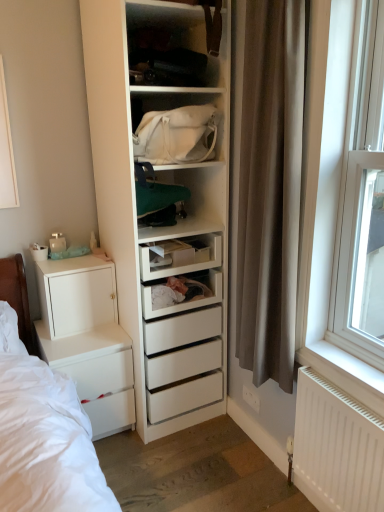
What do you see at coordinates (173, 46) in the screenshot? The width and height of the screenshot is (384, 512). I see `matte white shelf at upper center, the 2th shelf ordered from the bottom` at bounding box center [173, 46].

This screenshot has height=512, width=384. What do you see at coordinates (87, 338) in the screenshot? I see `white matte chest of drawers at left` at bounding box center [87, 338].

Describe the element at coordinates (324, 177) in the screenshot. This screenshot has height=512, width=384. I see `white plastic window at right` at that location.

Where is `white canvas bag at center, the first shelf in the bottom-to-top sequence`? white canvas bag at center, the first shelf in the bottom-to-top sequence is located at coordinates (177, 135).

The height and width of the screenshot is (512, 384). In order to click on brown fabric curtain at right in this screenshot , I will do `click(270, 188)`.

The image size is (384, 512). I want to click on matte white shelf at upper center, arranged as the 1th shelf when viewed from the top, so click(x=173, y=46).

From a real-world perspective, is white plastic window at right located higher than white canvas bag at center, the first shelf in the bottom-to-top sequence?

No.

Which object is thinner, white plastic window at right or white canvas bag at center, the first shelf in the bottom-to-top sequence?

white plastic window at right is thinner.

From the image's perspective, between white plastic window at right and white canvas bag at center, the first shelf in the bottom-to-top sequence, who is located below?

white plastic window at right appears lower in the image.

From their relative heights in the image, would you say white plastic window at right is taller or shorter than white matte cabinet at lower left?

In the image, white plastic window at right appears to be taller than white matte cabinet at lower left.

Who is more distant, white plastic window at right or white matte cabinet at lower left?

white matte cabinet at lower left is further away from the camera.

Is white plastic window at right inside or outside of white matte cabinet at lower left?

white plastic window at right exists outside the volume of white matte cabinet at lower left.

Is white plastic window at right looking in the opposite direction of white matte cabinet at lower left?

No, white plastic window at right is not facing away from white matte cabinet at lower left.

Considering the relative positions of white matte cabinet at lower left and matte white shelf at upper center, the 2th shelf ordered from the bottom, in the image provided, is white matte cabinet at lower left to the right of matte white shelf at upper center, the 2th shelf ordered from the bottom, from the viewer's perspective?

In fact, white matte cabinet at lower left is to the left of matte white shelf at upper center, the 2th shelf ordered from the bottom.

From the image's perspective, relative to matte white shelf at upper center, the 2th shelf ordered from the bottom, is white matte cabinet at lower left above or below?

From the image's perspective, white matte cabinet at lower left appears below matte white shelf at upper center, the 2th shelf ordered from the bottom.

Is white matte cabinet at lower left smaller than matte white shelf at upper center, arranged as the 1th shelf when viewed from the top?

Actually, white matte cabinet at lower left might be larger than matte white shelf at upper center, arranged as the 1th shelf when viewed from the top.

Between white plastic window at right and white matte radiator at lower right, which one appears on the left side from the viewer's perspective?

From the viewer's perspective, white matte radiator at lower right appears more on the left side.

Measure the distance between white plastic window at right and white matte radiator at lower right.

white plastic window at right is 15.53 inches away from white matte radiator at lower right.

How different are the orientations of white plastic window at right and white matte radiator at lower right in degrees?

The facing directions of white plastic window at right and white matte radiator at lower right are 0.0696 degrees apart.

Which of these two, white plastic window at right or white matte radiator at lower right, is bigger?

white plastic window at right.

Does white matte radiator at lower right have a greater height compared to brown fabric curtain at right?

No, white matte radiator at lower right is not taller than brown fabric curtain at right.

In order to click on curtain on the left side of white matte radiator at lower right in this screenshot , I will do `click(270, 188)`.

Can you tell me how much white matte radiator at lower right and brown fabric curtain at right differ in facing direction?

0.0705 degrees separate the facing orientations of white matte radiator at lower right and brown fabric curtain at right.

Considering the relative positions of white matte radiator at lower right and brown fabric curtain at right in the image provided, is white matte radiator at lower right in front of brown fabric curtain at right?

No, it is behind brown fabric curtain at right.

Considering the relative sizes of white matte cabinet at lower left and white canvas bag at center, marked as the 2th shelf in a top-to-bottom arrangement, in the image provided, is white matte cabinet at lower left shorter than white canvas bag at center, marked as the 2th shelf in a top-to-bottom arrangement,?

No.

Does point (75, 321) come closer to viewer compared to point (133, 105)?

No, (75, 321) is behind (133, 105).

Does white matte cabinet at lower left appear on the right side of white canvas bag at center, marked as the 2th shelf in a top-to-bottom arrangement?

No.

Is white matte cabinet at lower left aimed at white canvas bag at center, marked as the 2th shelf in a top-to-bottom arrangement?

No, white matte cabinet at lower left is not oriented towards white canvas bag at center, marked as the 2th shelf in a top-to-bottom arrangement.

Identify the location of window on the right of white matte cabinet at lower left. This screenshot has width=384, height=512. (324, 177).

From the image's perspective, does white matte cabinet at lower left appear higher than white plastic window at right?

Incorrect, from the image's perspective, white matte cabinet at lower left is lower than white plastic window at right.

Is white matte cabinet at lower left in front of or behind white plastic window at right in the image?

white matte cabinet at lower left is behind white plastic window at right.

Can you confirm if white matte cabinet at lower left is positioned to the right of white plastic window at right?

No.

Where is `window in front of the white canvas bag at center, the first shelf in the bottom-to-top sequence`? The height and width of the screenshot is (512, 384). window in front of the white canvas bag at center, the first shelf in the bottom-to-top sequence is located at coordinates click(x=324, y=177).

You are a GUI agent. You are given a task and a screenshot of the screen. Output one action in this format:
    pyautogui.click(x=<x>, y=<y>)
    Task: Click on the cabinetry below the white plastic window at right (from a real-world perspective)
    
    Given the screenshot: What is the action you would take?
    pyautogui.click(x=76, y=295)

Estimate the real-world distances between objects in this image. Which object is closer to white plastic window at right, brown fabric curtain at right or white canvas bag at center, marked as the 2th shelf in a top-to-bottom arrangement?

brown fabric curtain at right lies closer to white plastic window at right than the other object.

Based on their spatial positions, is white matte cabinet at lower left or matte white shelf at upper center, arranged as the 1th shelf when viewed from the top, further from white plastic window at right?

Based on the image, white matte cabinet at lower left appears to be further to white plastic window at right.

From the picture: Which object lies further to the anchor point white matte chest of drawers at left, white matte cabinet at lower left or brown fabric curtain at right?

brown fabric curtain at right lies further to white matte chest of drawers at left than the other object.

Based on the photo, when comparing their distances from white plastic window at right, does matte white shelf at upper center, arranged as the 1th shelf when viewed from the top, or white matte radiator at lower right seem closer?

The object closer to white plastic window at right is white matte radiator at lower right.

Based on their spatial positions, is matte white shelf at upper center, the 2th shelf ordered from the bottom, or brown fabric curtain at right further from white matte cabinet at lower left?

matte white shelf at upper center, the 2th shelf ordered from the bottom, lies further to white matte cabinet at lower left than the other object.

Which object lies further to the anchor point white matte radiator at lower right, white matte chest of drawers at left or brown fabric curtain at right?

The object further to white matte radiator at lower right is white matte chest of drawers at left.

From the image, which object appears to be farther from white matte chest of drawers at left, white canvas bag at center, the first shelf in the bottom-to-top sequence, or brown fabric curtain at right?

brown fabric curtain at right.

Looking at this image, when comparing their distances from white plastic window at right, does white matte chest of drawers at left or matte white shelf at upper center, the 2th shelf ordered from the bottom, seem further?

white matte chest of drawers at left is positioned further to the anchor white plastic window at right.

Find the location of a particular element. This screenshot has width=384, height=512. chest of drawers between white matte cabinet at lower left and white plastic window at right is located at coordinates (87, 338).

I want to click on radiator between white matte chest of drawers at left and white plastic window at right from left to right, so click(x=336, y=447).

This screenshot has height=512, width=384. Identify the location of chest of drawers between white matte cabinet at lower left and brown fabric curtain at right. (87, 338).

You are a GUI agent. You are given a task and a screenshot of the screen. Output one action in this format:
    pyautogui.click(x=<x>, y=<y>)
    Task: Click on the shelf between matte white shelf at upper center, arranged as the 1th shelf when viewed from the top, and white matte radiator at lower right from top to bottom
    This screenshot has width=384, height=512.
    Given the screenshot: What is the action you would take?
    pyautogui.click(x=177, y=135)